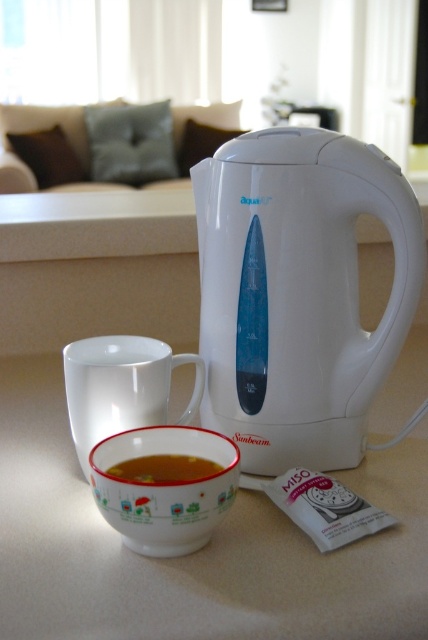
Question: Which object appears closest to the camera in this image?

Choices:
 (A) white glossy electric kettle at center
 (B) white glossy table at center

Answer: (B)

Question: Which point appears closest to the camera in this image?

Choices:
 (A) (128, 339)
 (B) (189, 497)
 (C) (262, 381)

Answer: (B)

Question: Is white glossy mug at lower center wider than porcelain mug with green and red design at lower center?

Choices:
 (A) yes
 (B) no

Answer: (B)

Question: Is white glossy electric kettle at center further to camera compared to translucent glass bowl at lower center?

Choices:
 (A) no
 (B) yes

Answer: (B)

Question: Does white glossy electric kettle at center appear on the left side of white glossy mug at lower center?

Choices:
 (A) yes
 (B) no

Answer: (B)

Question: Which object is the closest to the white glossy electric kettle at center?

Choices:
 (A) porcelain mug with green and red design at lower center
 (B) white glossy table at center
 (C) translucent glass bowl at lower center
 (D) white glossy mug at lower center

Answer: (A)